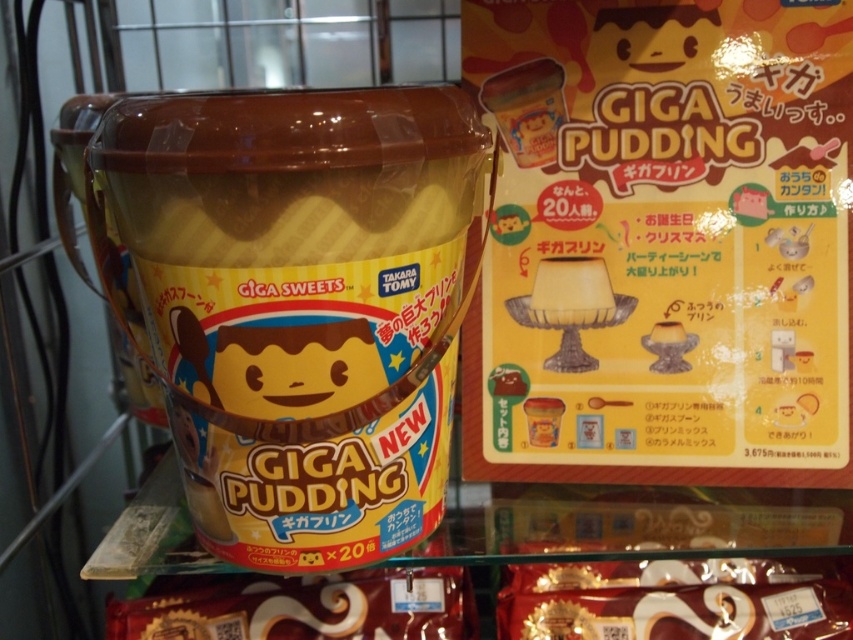
You are a store employee arranging items on a shelf. You have a matte plastic pudding at center and a shiny chocolate bar at lower right. Which item should you place higher on the shelf if you want the taller item to be more visible to customers?

The matte plastic pudding at center is taller than the shiny chocolate bar at lower right, so you should place the matte plastic pudding at center higher on the shelf to make it more visible.